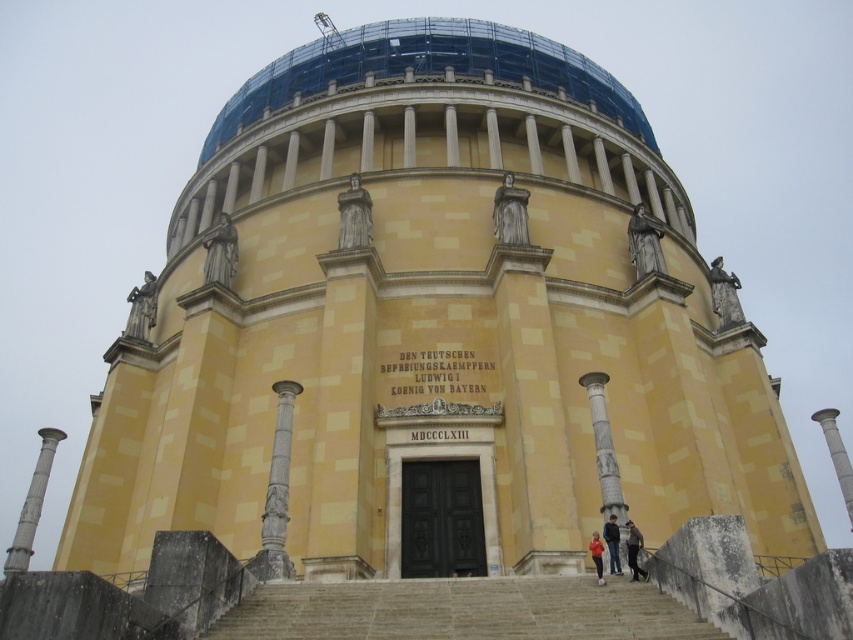
Is blue denim jeans at lower center shorter than red fabric jacket at lower center?

No.

Can you confirm if blue denim jeans at lower center is smaller than red fabric jacket at lower center?

No, blue denim jeans at lower center is not smaller than red fabric jacket at lower center.

Measure the distance between blue denim jeans at lower center and camera.

blue denim jeans at lower center is 35.82 meters from camera.

In order to click on blue denim jeans at lower center in this screenshot , I will do `click(612, 544)`.

Can you confirm if white marble column at center is positioned below polished stone statue at upper right?

Yes, white marble column at center is below polished stone statue at upper right.

This screenshot has width=853, height=640. I want to click on white marble column at center, so click(x=604, y=448).

Locate an element on the screen. white marble column at center is located at coordinates (604, 448).

Is point (605, 490) positioned after point (645, 246)?

No.

Between white marble column at center and stone statue at right, which one is positioned higher?

Positioned higher is stone statue at right.

Which is behind, point (614, 499) or point (640, 259)?

Point (640, 259)

Where is `white marble column at center`? white marble column at center is located at coordinates (604, 448).